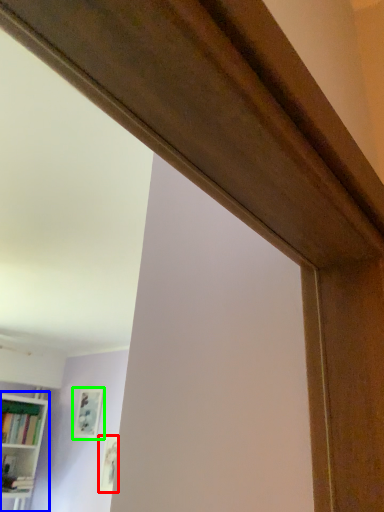
Question: Which object is the farthest from picture frame (highlighted by a red box)? Choose among these: bookcase (highlighted by a blue box) or picture frame (highlighted by a green box).

Choices:
 (A) bookcase
 (B) picture frame

Answer: (A)